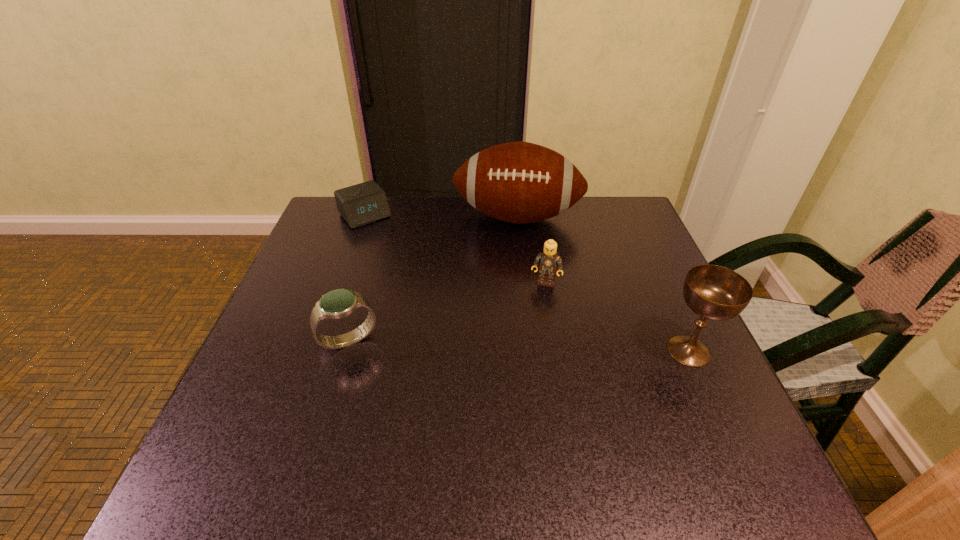
Choose which object is the second nearest neighbor to the tallest object. Please provide its 2D coordinates. Your answer should be formatted as a tuple, i.e. [(x, y)], where the tuple contains the x and y coordinates of a point satisfying the conditions above.

[(364, 203)]

The image size is (960, 540). Identify the location of free space that satisfies the following two spatial constraints: 1. on the back side of the watch; 2. on the right side of the Lego. pos(366,282).

Find the location of a particular element. The image size is (960, 540). free space that satisfies the following two spatial constraints: 1. on the back side of the Lego; 2. on the left side of the watch is located at coordinates (366, 282).